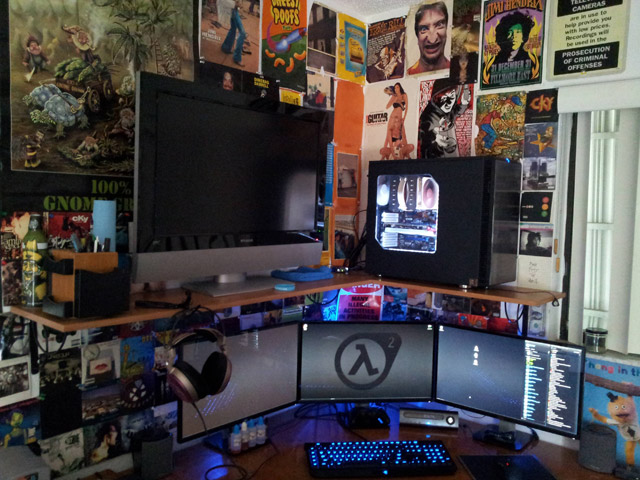
Where is `window`? This screenshot has height=480, width=640. window is located at coordinates (604, 226).